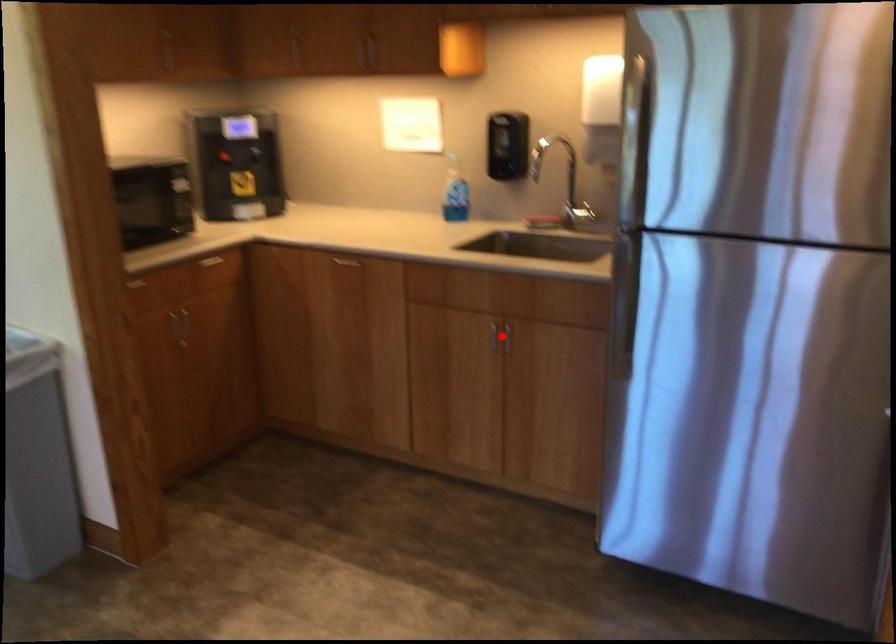
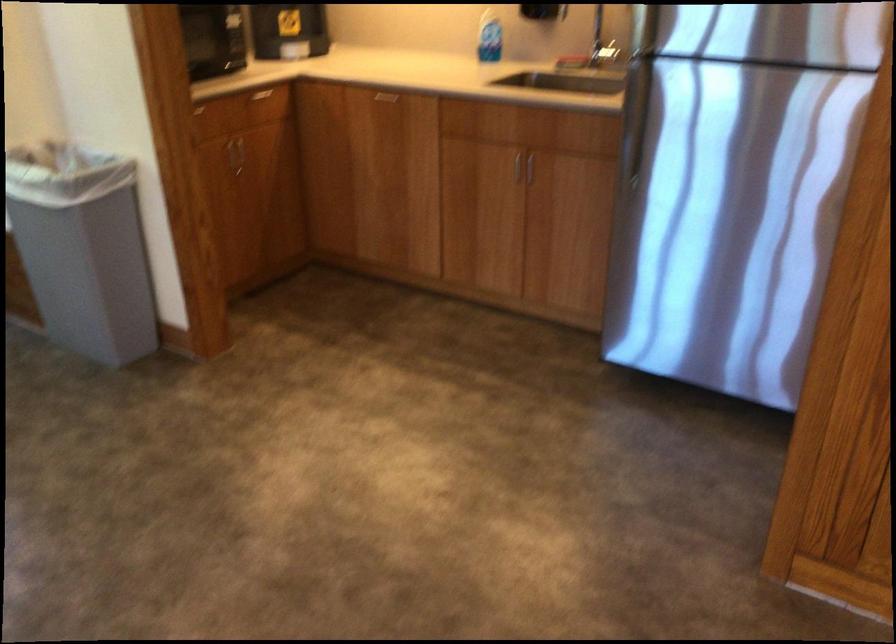
Locate, in the second image, the point that corresponds to the highlighted location in the first image.

(524, 166)